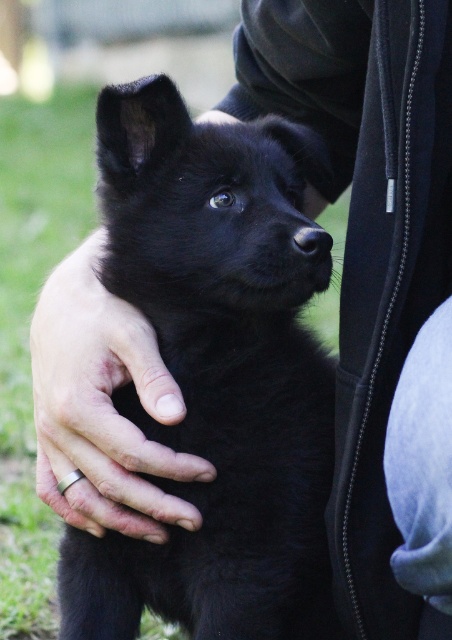
Question: In this image, where is black furry dog at center located relative to silver metallic ring at lower left?

Choices:
 (A) right
 (B) left

Answer: (A)

Question: Which point is farther to the camera?

Choices:
 (A) (89, 326)
 (B) (224, 372)

Answer: (A)

Question: Is the position of black furry dog at center less distant than that of silver metallic ring at lower left?

Choices:
 (A) yes
 (B) no

Answer: (A)

Question: Is black furry dog at center positioned before silver metallic ring at lower left?

Choices:
 (A) no
 (B) yes

Answer: (B)

Question: Which object appears farthest from the camera in this image?

Choices:
 (A) silver metallic ring at lower left
 (B) black furry dog at center

Answer: (A)

Question: Which point is closer to the camera taking this photo?

Choices:
 (A) (217, 477)
 (B) (118, 356)

Answer: (A)